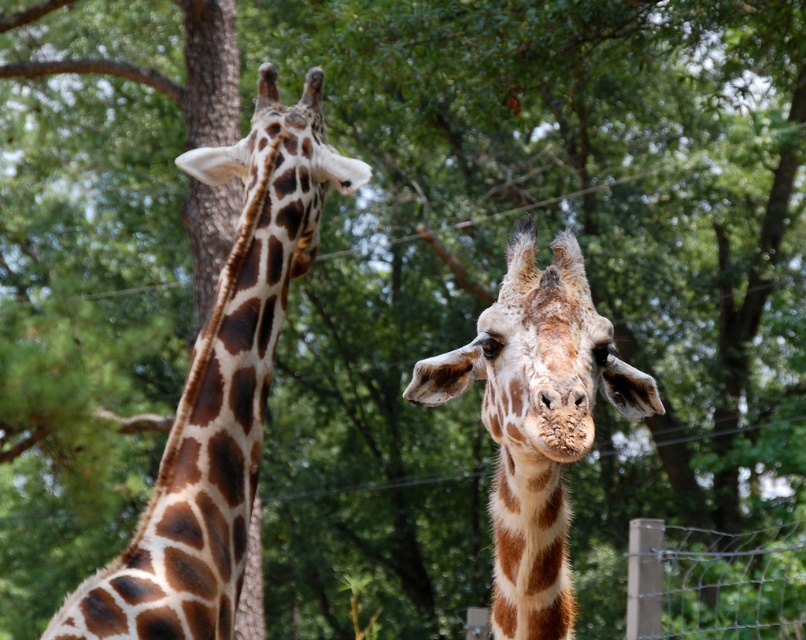
Does brown spotted giraffe at left have a greater height compared to brown spotted giraffe at center?

Yes, brown spotted giraffe at left is taller than brown spotted giraffe at center.

Which is in front, point (198, 608) or point (422, 371)?

Positioned in front is point (422, 371).

Locate an element on the screen. brown spotted giraffe at left is located at coordinates (221, 388).

Can you confirm if brown spotted giraffe at center is shorter than wire mesh fence at lower right?

No.

Is brown spotted giraffe at center smaller than wire mesh fence at lower right?

Yes, brown spotted giraffe at center is smaller than wire mesh fence at lower right.

Between point (530, 227) and point (663, 612), which one is positioned behind?

Point (663, 612)

Find the location of `brown spotted giraffe at center`. brown spotted giraffe at center is located at coordinates (536, 420).

Looking at this image, does brown spotted giraffe at left lie in front of wire mesh fence at lower right?

Yes, brown spotted giraffe at left is closer to the viewer.

Does brown spotted giraffe at left appear on the left side of wire mesh fence at lower right?

Yes, brown spotted giraffe at left is to the left of wire mesh fence at lower right.

Which is in front, point (121, 570) or point (738, 593)?

Point (121, 570)

Locate an element on the screen. The image size is (806, 640). brown spotted giraffe at left is located at coordinates (221, 388).